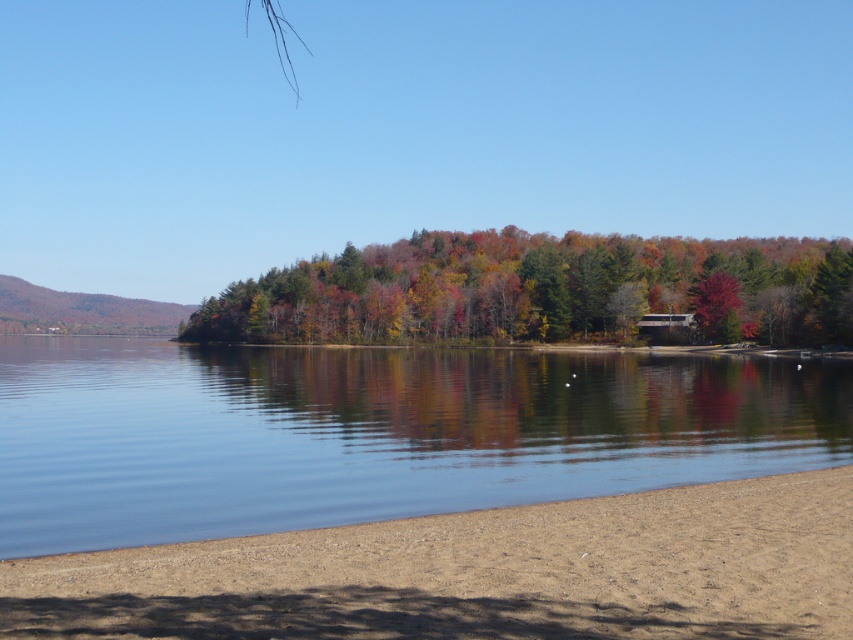
Consider the image. Between clear water at center and multicolored foliage at center, which one appears on the right side from the viewer's perspective?

From the viewer's perspective, multicolored foliage at center appears more on the right side.

Is clear water at center closer to the viewer compared to multicolored foliage at center?

Yes, it is in front of multicolored foliage at center.

Is point (454, 396) closer to viewer compared to point (711, 337)?

Yes, point (454, 396) is closer to viewer.

Where is `clear water at center`? The image size is (853, 640). clear water at center is located at coordinates (374, 433).

Which is more to the right, clear water at center or brown sandy beach at lower center?

brown sandy beach at lower center

Does clear water at center appear on the right side of brown sandy beach at lower center?

In fact, clear water at center is to the left of brown sandy beach at lower center.

Measure the distance between point (64, 362) and camera.

The distance of point (64, 362) from camera is 320.91 feet.

You are a GUI agent. You are given a task and a screenshot of the screen. Output one action in this format:
    pyautogui.click(x=<x>, y=<y>)
    Task: Click on the clear water at center
    The width and height of the screenshot is (853, 640).
    Given the screenshot: What is the action you would take?
    pyautogui.click(x=374, y=433)

Where is `brown sandy beach at lower center`? brown sandy beach at lower center is located at coordinates (480, 572).

Where is `brown sandy beach at lower center`? brown sandy beach at lower center is located at coordinates (480, 572).

Image resolution: width=853 pixels, height=640 pixels. What are the coordinates of `brown sandy beach at lower center` in the screenshot? It's located at (480, 572).